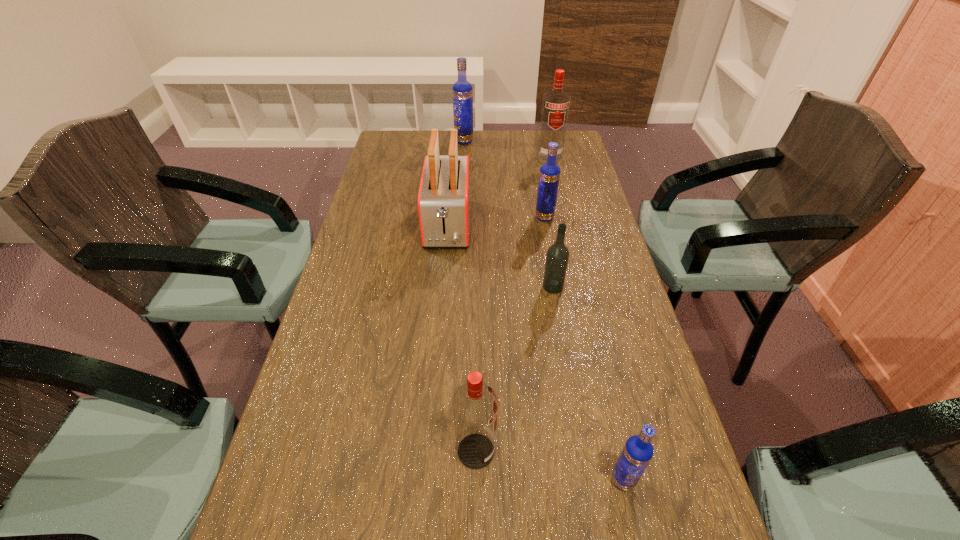
Where is `vacant space that satisfies the following two spatial constraints: 1. on the front-facing side of the fifth farthest object; 2. on the left side of the toaster`? This screenshot has height=540, width=960. vacant space that satisfies the following two spatial constraints: 1. on the front-facing side of the fifth farthest object; 2. on the left side of the toaster is located at coordinates (443, 287).

Locate an element on the screen. This screenshot has height=540, width=960. vacant area that satisfies the following two spatial constraints: 1. on the front side of the farthest object; 2. on the right side of the nearest blue vodka is located at coordinates (445, 480).

You are a GUI agent. You are given a task and a screenshot of the screen. Output one action in this format:
    pyautogui.click(x=<x>, y=<y>)
    Task: Click on the vacant space that satisfies the following two spatial constraints: 1. on the front-facing side of the toaster; 2. on the left side of the rightmost blue vodka
    The width and height of the screenshot is (960, 540).
    Given the screenshot: What is the action you would take?
    pyautogui.click(x=426, y=480)